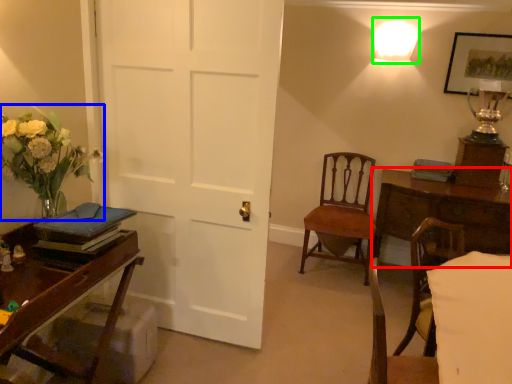
Question: Which object is the farthest from table (highlighted by a red box)? Choose among these: floral arrangement (highlighted by a blue box) or lighting (highlighted by a green box).

Choices:
 (A) floral arrangement
 (B) lighting

Answer: (A)